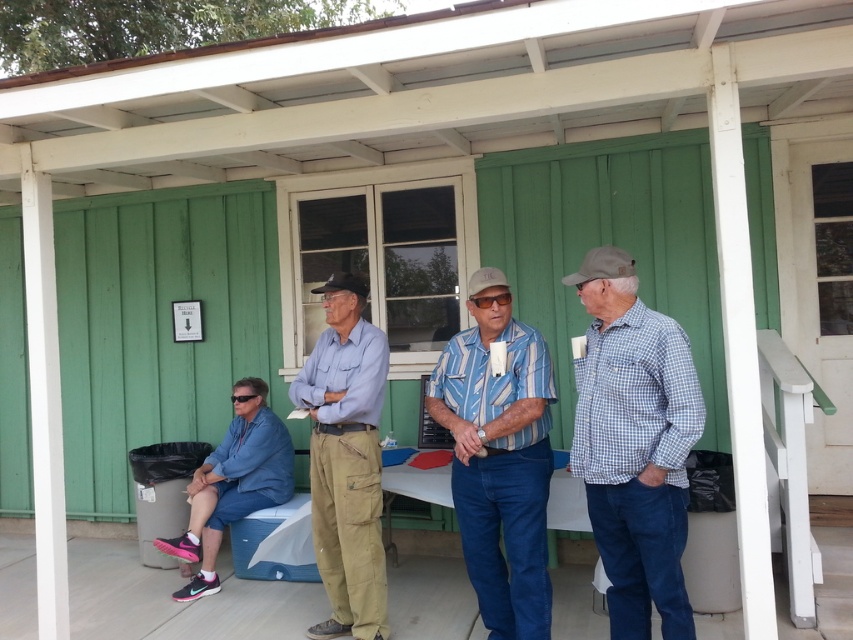
Question: Which object is positioned closest to the white checkered shirt at right?

Choices:
 (A) matte blue shirt at center
 (B) blue striped shirt at center

Answer: (B)

Question: Among these points, which one is farthest from the camera?

Choices:
 (A) (502, 310)
 (B) (635, 476)
 (C) (299, 397)
 (D) (190, 518)

Answer: (D)

Question: Which of the following is the closest to the observer?

Choices:
 (A) (666, 625)
 (B) (331, 358)
 (C) (178, 554)
 (D) (524, 406)

Answer: (A)

Question: Is white checkered shirt at right to the right of blue striped shirt at center from the viewer's perspective?

Choices:
 (A) yes
 (B) no

Answer: (A)

Question: Is matte blue shirt at center to the right of blue denim shorts at lower left from the viewer's perspective?

Choices:
 (A) no
 (B) yes

Answer: (B)

Question: Is blue striped shirt at center below matte blue shirt at center?

Choices:
 (A) no
 (B) yes

Answer: (A)